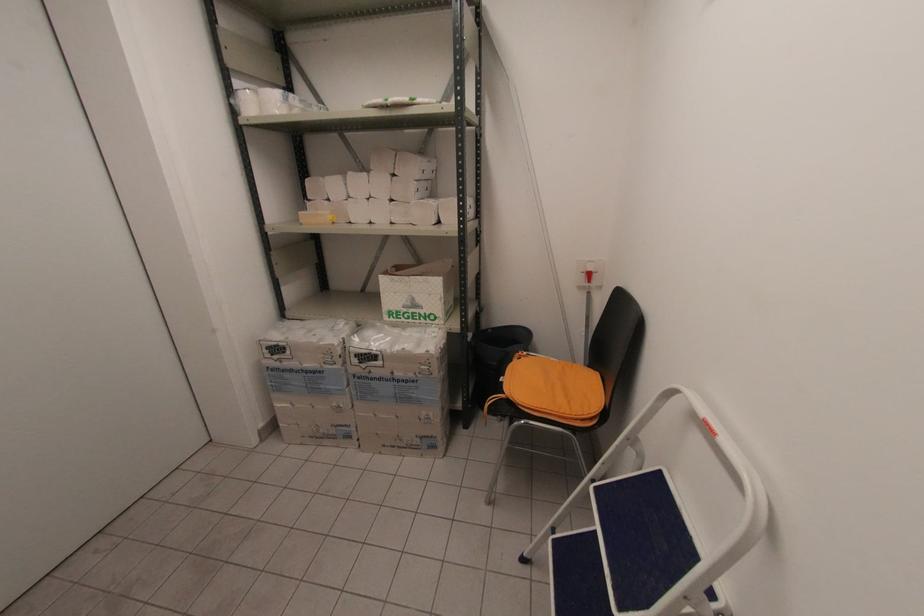
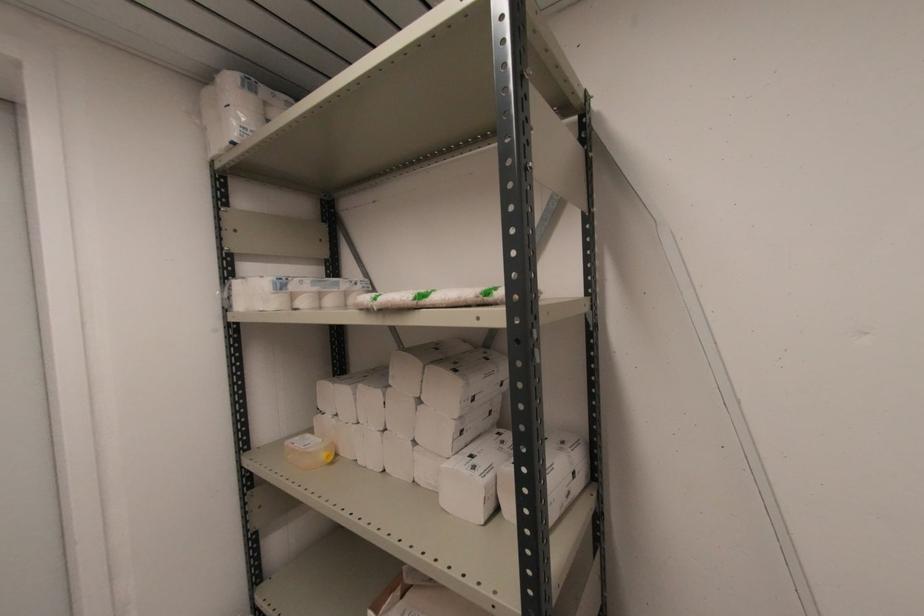
Locate, in the second image, the point that corresponds to point (301, 214) in the first image.

(289, 442)